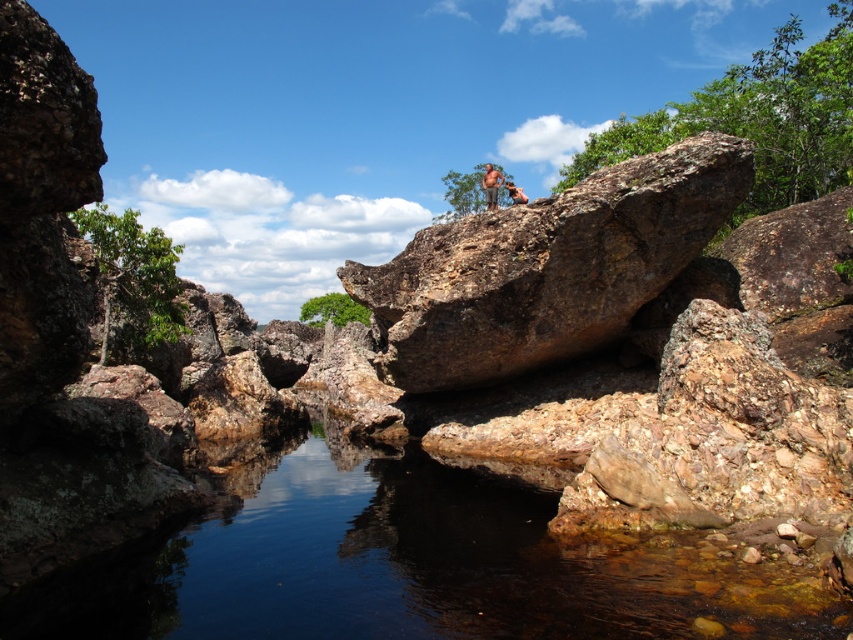
Which is above, clear water at center or brown textured shorts at upper center?

brown textured shorts at upper center is above.

Is clear water at center positioned behind brown textured shorts at upper center?

No, clear water at center is closer to the viewer.

Is point (473, 582) farther from camera compared to point (488, 173)?

No, (473, 582) is in front of (488, 173).

The image size is (853, 640). I want to click on clear water at center, so click(412, 566).

How much distance is there between clear water at center and tan skin human at center?

They are 65.18 feet apart.

Find the location of `clear water at center`. clear water at center is located at coordinates click(412, 566).

In order to click on clear water at center in this screenshot , I will do `click(412, 566)`.

What do you see at coordinates (491, 186) in the screenshot?
I see `brown textured shorts at upper center` at bounding box center [491, 186].

Is brown textured shorts at upper center wider than tan skin human at center?

No.

Which is in front, point (489, 195) or point (515, 186)?

Point (489, 195)

Where is `brown textured shorts at upper center`? The image size is (853, 640). brown textured shorts at upper center is located at coordinates (491, 186).